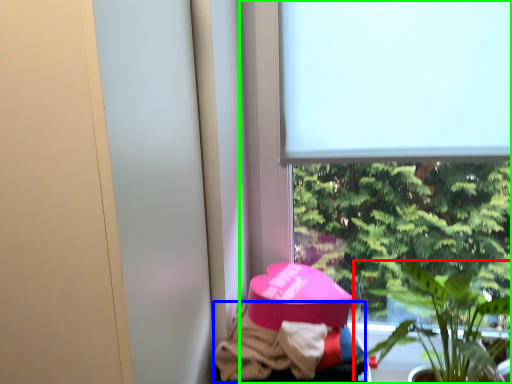
Question: Considering the real-world distances, which object is farthest from houseplant (highlighted by a red box)? clothing (highlighted by a blue box) or window (highlighted by a green box)?

Choices:
 (A) clothing
 (B) window

Answer: (A)